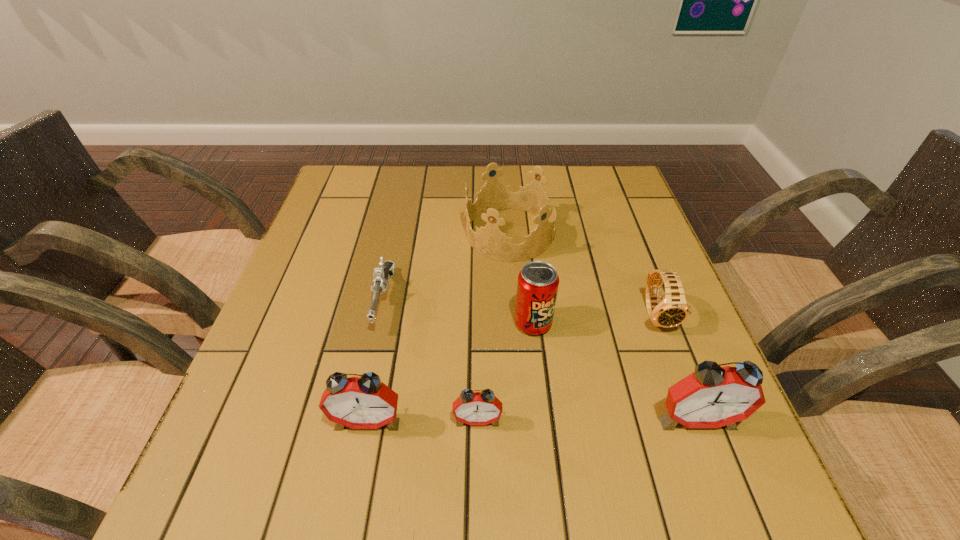
What are the coordinates of `free space located on the face of the watch` in the screenshot? It's located at (705, 438).

You are a GUI agent. You are given a task and a screenshot of the screen. Output one action in this format:
    pyautogui.click(x=<x>, y=<y>)
    Task: Click on the free region located aimed along the barrel of the gun
    
    Given the screenshot: What is the action you would take?
    tap(368, 374)

Identify the location of vacant region located 0.050m on the front of the soda can. The height and width of the screenshot is (540, 960). (537, 358).

Locate an element on the screen. object at the far edge is located at coordinates (489, 241).

In order to click on alarm clock that is at the right edge in this screenshot , I will do pos(713,396).

Identify the location of watch at the right edge. This screenshot has width=960, height=540. (671, 311).

The height and width of the screenshot is (540, 960). Find the location of `object that is at the near right corner`. object that is at the near right corner is located at coordinates (713, 396).

In order to click on free region at the far edge of the desktop in this screenshot , I will do `click(454, 179)`.

The image size is (960, 540). In order to click on vacant space at the near edge in this screenshot , I will do `click(340, 436)`.

This screenshot has width=960, height=540. In order to click on blank space at the left edge of the desktop in this screenshot , I will do `click(343, 227)`.